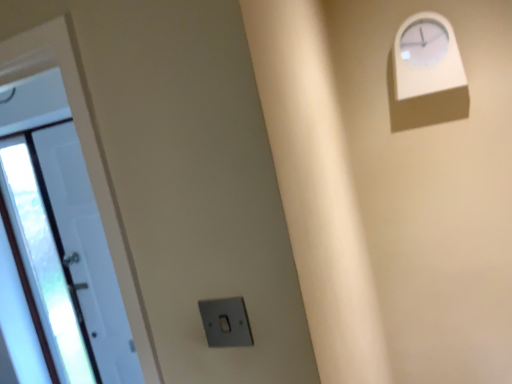
Question: Does white glossy door at left contain satin silver switch at lower center?

Choices:
 (A) yes
 (B) no

Answer: (B)

Question: Considering the relative positions of white glossy door at left and satin silver switch at lower center in the image provided, is white glossy door at left behind satin silver switch at lower center?

Choices:
 (A) no
 (B) yes

Answer: (B)

Question: Considering the relative positions of white glossy door at left and satin silver switch at lower center in the image provided, is white glossy door at left to the left of satin silver switch at lower center from the viewer's perspective?

Choices:
 (A) yes
 (B) no

Answer: (A)

Question: Is white glossy door at left far from satin silver switch at lower center?

Choices:
 (A) yes
 (B) no

Answer: (B)

Question: Could you tell me if white glossy door at left is facing satin silver switch at lower center?

Choices:
 (A) no
 (B) yes

Answer: (A)

Question: Is white glossy door at left in front of or behind white plastic clock at upper right in the image?

Choices:
 (A) front
 (B) behind

Answer: (B)

Question: From the image's perspective, is white glossy door at left located above or below white plastic clock at upper right?

Choices:
 (A) below
 (B) above

Answer: (A)

Question: Based on their sizes in the image, would you say white glossy door at left is bigger or smaller than white plastic clock at upper right?

Choices:
 (A) big
 (B) small

Answer: (A)

Question: Which is correct: white glossy door at left is inside white plastic clock at upper right, or outside of it?

Choices:
 (A) inside
 (B) outside

Answer: (B)

Question: From a real-world perspective, is satin silver switch at lower center physically located above or below white glossy door at left?

Choices:
 (A) above
 (B) below

Answer: (A)

Question: From the image's perspective, is satin silver switch at lower center above or below white glossy door at left?

Choices:
 (A) below
 (B) above

Answer: (B)

Question: Is satin silver switch at lower center in front of or behind white glossy door at left in the image?

Choices:
 (A) front
 (B) behind

Answer: (A)

Question: In the image, is satin silver switch at lower center on the left side or the right side of white glossy door at left?

Choices:
 (A) left
 (B) right

Answer: (B)

Question: From the image's perspective, is white plastic clock at upper right above or below satin silver switch at lower center?

Choices:
 (A) above
 (B) below

Answer: (A)

Question: Considering their positions, is white plastic clock at upper right located in front of or behind satin silver switch at lower center?

Choices:
 (A) behind
 (B) front

Answer: (A)